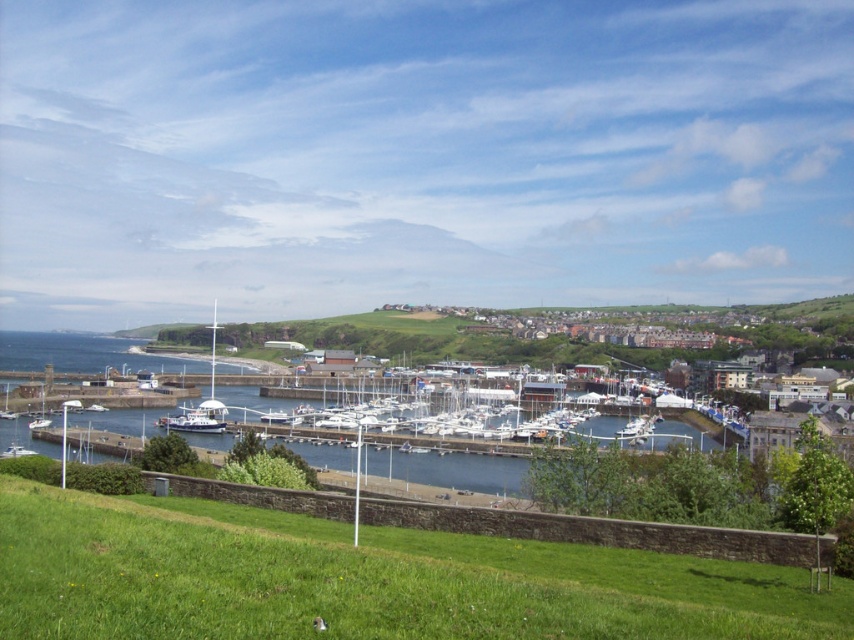
Question: Which of the following is the farthest from the observer?

Choices:
 (A) (3, 621)
 (B) (16, 413)
 (C) (45, 426)

Answer: (B)

Question: Does green grass at lower left lie behind white glossy boat at lower left?

Choices:
 (A) no
 (B) yes

Answer: (A)

Question: Among these objects, which one is farthest from the camera?

Choices:
 (A) green grass at lower left
 (B) white glossy sailboat at lower left
 (C) white glossy boat at lower left

Answer: (C)

Question: Which point is closer to the camera?

Choices:
 (A) (452, 627)
 (B) (638, 420)
 (C) (36, 428)

Answer: (A)

Question: Does white glossy boat at center appear on the right side of white glossy sailboat at lower left?

Choices:
 (A) yes
 (B) no

Answer: (A)

Question: Can you confirm if green grass at lower left is wider than white glossy boat at center?

Choices:
 (A) yes
 (B) no

Answer: (A)